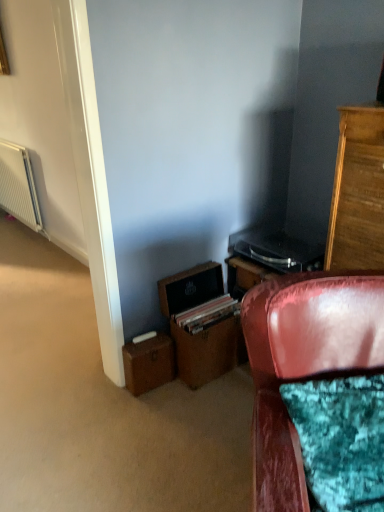
Identify the location of free space in front of brown leather file cabinet at lower center. coord(201,406).